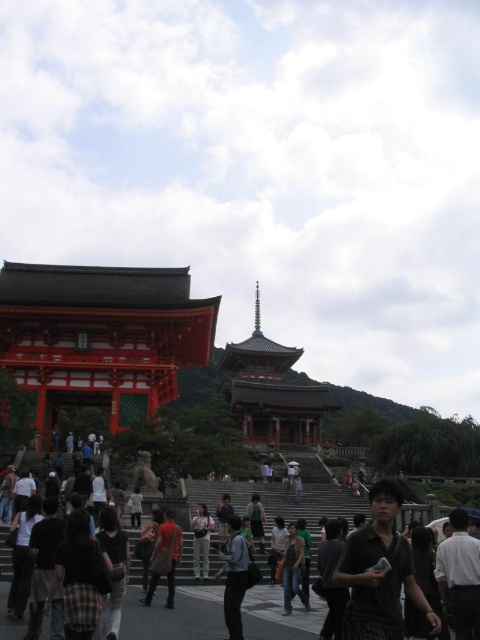
Question: Is dark gray fabric shirt at lower left to the left of dark gray fabric backpack at center from the viewer's perspective?

Choices:
 (A) no
 (B) yes

Answer: (B)

Question: Estimate the real-world distances between objects in this image. Which object is closer to the dark brown hair at lower center?

Choices:
 (A) shiny red pagoda at center
 (B) orange shirt at center
 (C) plaid fabric shirt at lower left
 (D) green fabric backpack at center

Answer: (C)

Question: Is dark gray clothing at lower center positioned before dark brown hair at lower center?

Choices:
 (A) yes
 (B) no

Answer: (B)

Question: Among these points, which one is farthest from the camera?

Choices:
 (A) (225, 538)
 (B) (93, 621)
 (C) (112, 541)
 (D) (460, 630)

Answer: (A)

Question: Which of these objects is positioned farthest from the dark brown leather jacket at center?

Choices:
 (A) plaid fabric shirt at lower left
 (B) light brown leather bag at center

Answer: (A)

Question: Where is dark brown hair at lower center located in relation to light brown leather bag at center in the image?

Choices:
 (A) right
 (B) left

Answer: (A)